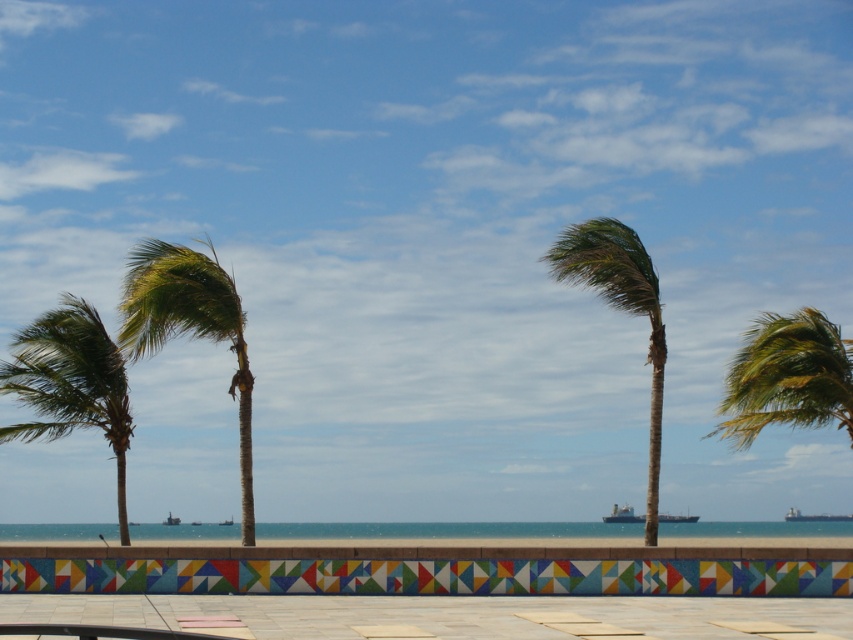
You are standing at the beach looking at the tiled wall and the palm trees. There is a point marked at coordinates point (616, 513). If you want to place a 30 meter long boat exactly at that point, will it fit without overlapping any other objects in the scene?

The distance between the point (616, 513) and the viewer is 68.88 meters. Since the boat is only 30 meters long, there is enough space for it to fit without overlapping other objects as the distance is greater than the boat length.

You are standing on the beach and see the blue water at center and the metallic gray ship at center. Which one is wider?

The blue water at center is wider than the metallic gray ship at center.

You are a tour guide explaining the beach scene to visitors. You mention both the blue water at center and the metallic gray ship at center. How far apart are these two elements in the scene?

The blue water at center and the metallic gray ship at center are 25.33 feet apart from each other.